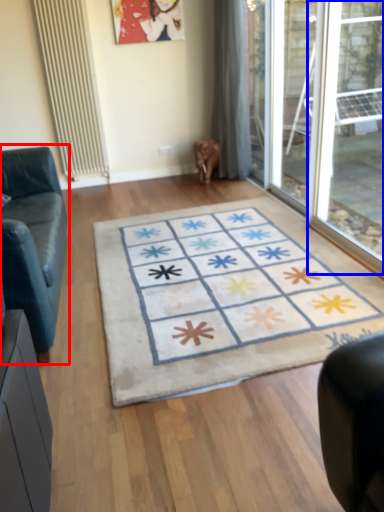
Question: Among these objects, which one is farthest to the camera, studio couch (highlighted by a red box) or window (highlighted by a blue box)?

Choices:
 (A) studio couch
 (B) window

Answer: (B)